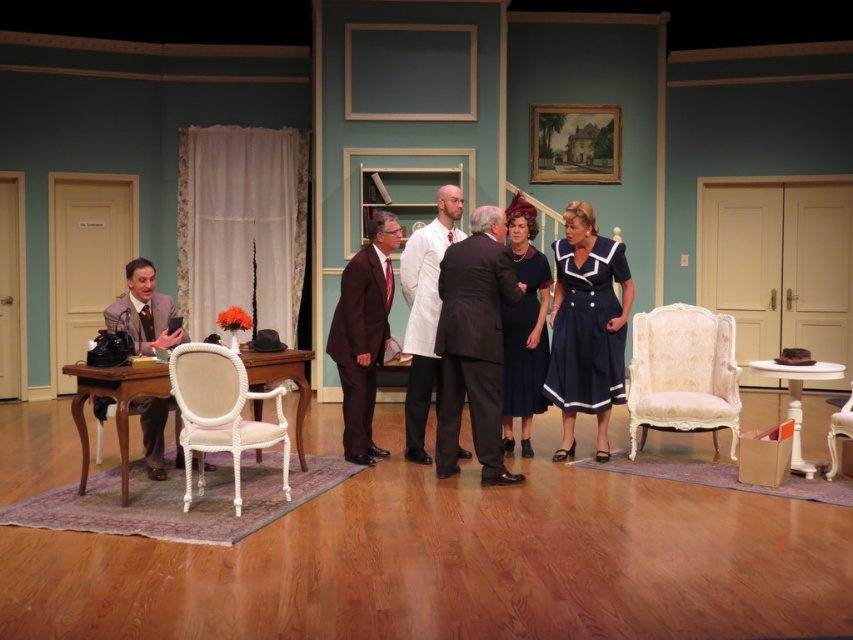
You are a stagehand preparing to adjust the lighting for a play. You need to ensure that the white rope chair at center and the shiny brown suit at center are both fully illuminated. Given their heights, which object might require a spotlight with a wider beam to ensure proper coverage?

The shiny brown suit at center is taller than the white rope chair at center, so it might require a spotlight with a wider beam to ensure proper coverage.

You are an actor positioned at the center of the stage and need to exit through the door on the left wall. The velvet navy dress at center is blocking your path. Can you move around it to reach the door without stepping on it?

The velvet navy dress at center is located at point (x=524, y=328), which is in the center of the stage. Since you are also at the center, you can move around it either to the left or right to reach the door on the left wall without stepping on the dress.

You are a stagehand preparing to move the white rope chair at center and the shiny brown suit at center onto a smaller platform. Which object should you move first to ensure they both fit?

The shiny brown suit at center should be moved first since it is smaller than the white rope chair at center, allowing more space for the larger chair afterward.